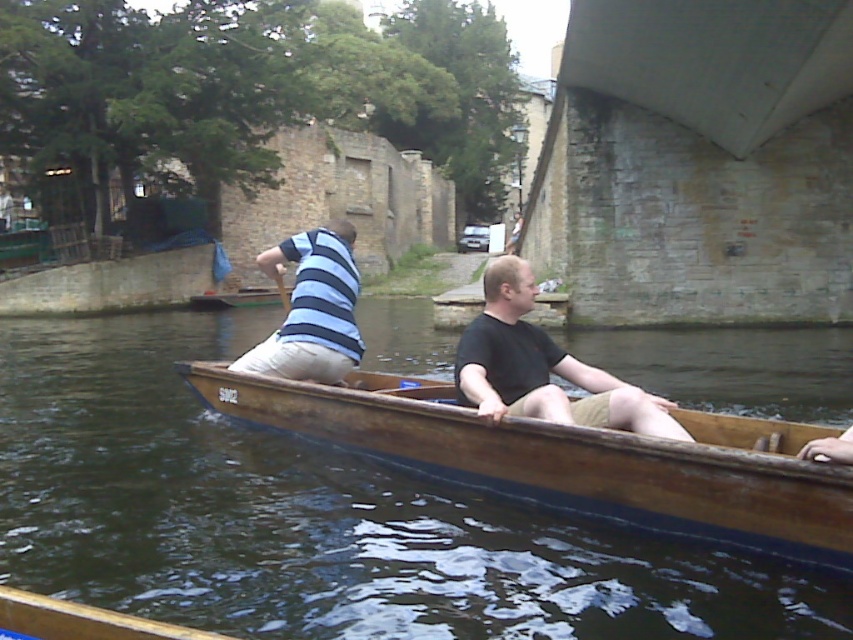
Which is more to the right, matte black shirt at center or blue striped shirt at center?

Positioned to the right is matte black shirt at center.

Can you confirm if matte black shirt at center is positioned to the right of blue striped shirt at center?

Correct, you'll find matte black shirt at center to the right of blue striped shirt at center.

Identify the location of matte black shirt at center. (543, 368).

What are the coordinates of `matte black shirt at center` in the screenshot? It's located at (543, 368).

Between point (491, 449) and point (279, 284), which one is positioned in front?

Point (491, 449)

Locate an element on the screen. The image size is (853, 640). wooden canoe at center is located at coordinates (572, 458).

Which is above, wooden canoe at center or matte black shirt at center?

matte black shirt at center is above.

Can you confirm if wooden canoe at center is positioned to the left of matte black shirt at center?

Correct, you'll find wooden canoe at center to the left of matte black shirt at center.

Which is in front, point (526, 493) or point (527, 330)?

Point (526, 493) is more forward.

Locate an element on the screen. This screenshot has height=640, width=853. wooden canoe at center is located at coordinates (572, 458).